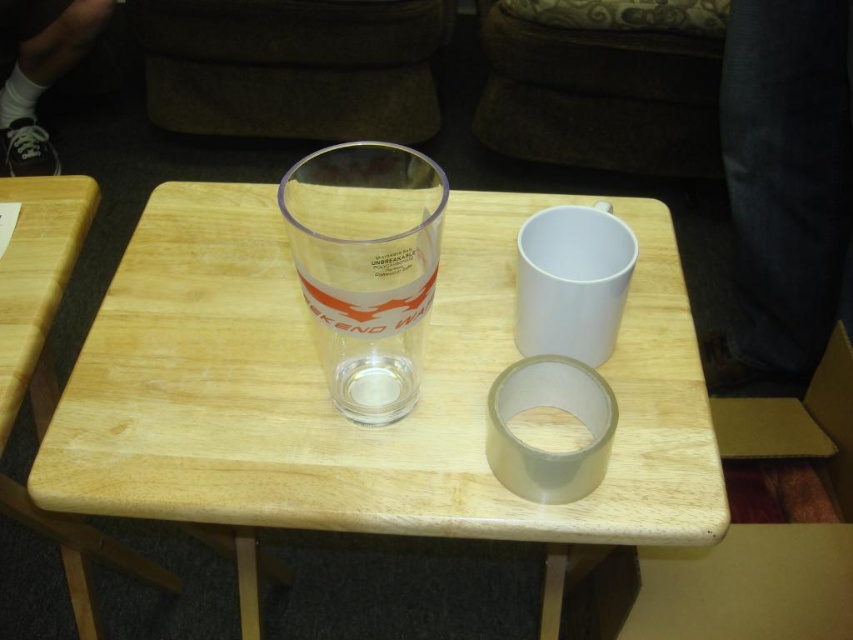
You are arranging items on a table and need to place a small ornament between the clear glass shot glass at center and the light wood table at left. Where should you position it?

The small ornament should be placed between the clear glass shot glass at center and the light wood table at left, closer to the light wood table at left since the shot glass is to the right of the table.

You are arranging items on a table and need to place a new item between the transparent plastic cup at center and the light wood table at left. Where should you place it?

You should place the new item between the transparent plastic cup at center and the light wood table at left, to the left of the cup and right of the table since the cup is to the right of the table.